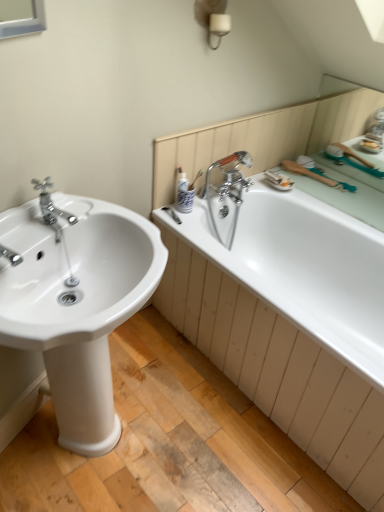
Question: From a real-world perspective, does white glossy sink at left stand above white glossy bathtub at right?

Choices:
 (A) yes
 (B) no

Answer: (A)

Question: Is white glossy sink at left at the left side of white glossy bathtub at right?

Choices:
 (A) no
 (B) yes

Answer: (B)

Question: Can you confirm if white glossy sink at left is shorter than white glossy bathtub at right?

Choices:
 (A) yes
 (B) no

Answer: (B)

Question: Is white glossy sink at left far away from white glossy bathtub at right?

Choices:
 (A) no
 (B) yes

Answer: (A)

Question: From the image's perspective, would you say white glossy sink at left is positioned over white glossy bathtub at right?

Choices:
 (A) yes
 (B) no

Answer: (B)

Question: Can you confirm if white glossy sink at left is smaller than white glossy bathtub at right?

Choices:
 (A) no
 (B) yes

Answer: (B)

Question: From the image's perspective, does white glossy bathtub at right appear higher than white glossy sink at left?

Choices:
 (A) yes
 (B) no

Answer: (A)

Question: Is the depth of white glossy bathtub at right greater than that of white glossy sink at left?

Choices:
 (A) no
 (B) yes

Answer: (B)

Question: Is white glossy bathtub at right not close to white glossy sink at left?

Choices:
 (A) no
 (B) yes

Answer: (A)

Question: Can you confirm if white glossy bathtub at right is positioned to the right of white glossy sink at left?

Choices:
 (A) no
 (B) yes

Answer: (B)

Question: Can you confirm if white glossy bathtub at right is smaller than white glossy sink at left?

Choices:
 (A) yes
 (B) no

Answer: (B)

Question: Is the position of white glossy bathtub at right less distant than that of white glossy sink at left?

Choices:
 (A) yes
 (B) no

Answer: (B)

Question: Can you confirm if white glossy sink at left is shorter than polished chrome faucet at left?

Choices:
 (A) no
 (B) yes

Answer: (A)